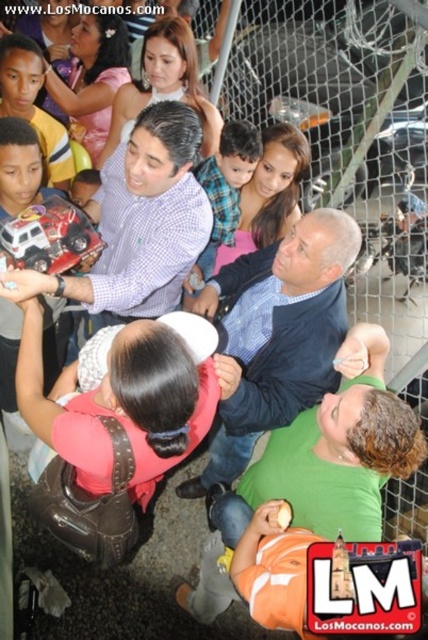
Is blue textured shirt at center thinner than matte plaid shirt at center?

Incorrect, blue textured shirt at center's width is not less than matte plaid shirt at center's.

In the scene shown: Measure the distance between blue textured shirt at center and camera.

5.96 feet

Where is `blue textured shirt at center`? The image size is (428, 640). blue textured shirt at center is located at coordinates (276, 336).